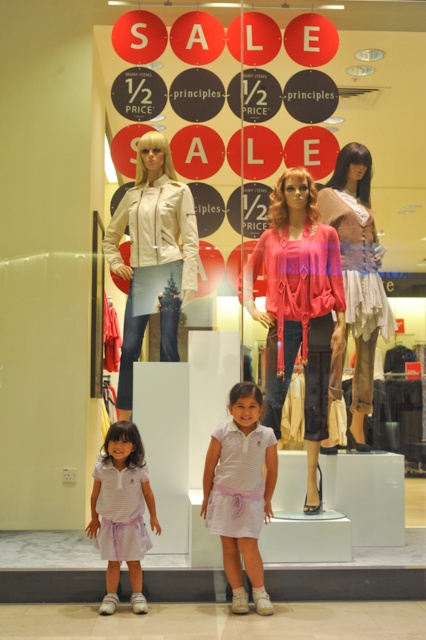
Between pink satin dress at center and white striped dress at center, which one appears on the left side from the viewer's perspective?

white striped dress at center is more to the left.

Does pink satin dress at center appear over white striped dress at center?

Correct, pink satin dress at center is located above white striped dress at center.

Measure the distance between point (362,262) and camera.

Point (362,262) is 16.52 feet away from camera.

Identify the location of pink satin dress at center. The height and width of the screenshot is (640, 426). (357, 262).

Can you confirm if pink fabric blouse at center is bigger than pink fabric dress at center?

Yes, pink fabric blouse at center is bigger than pink fabric dress at center.

Which is above, pink fabric blouse at center or pink fabric dress at center?

pink fabric dress at center is higher up.

Locate an element on the screen. The image size is (426, 640). pink fabric blouse at center is located at coordinates (298, 307).

Can you confirm if pink fabric dress at center is positioned below pink satin dress at center?

Correct, pink fabric dress at center is located below pink satin dress at center.

Can you confirm if pink fabric dress at center is bigger than pink satin dress at center?

Indeed, pink fabric dress at center has a larger size compared to pink satin dress at center.

The width and height of the screenshot is (426, 640). I want to click on pink fabric dress at center, so click(357, 273).